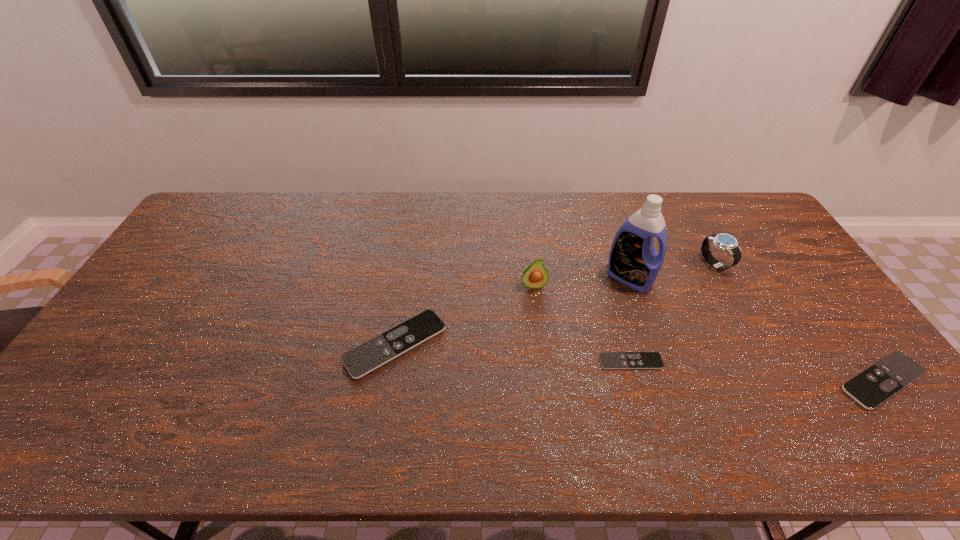
This screenshot has height=540, width=960. I want to click on vacant region located 0.230m on the back of the leftmost object, so click(410, 259).

Identify the location of vacant space located on the left of the shortest remote control. This screenshot has width=960, height=540. (500, 362).

I want to click on vacant space situated 0.070m on the back of the second shortest remote control, so click(x=847, y=332).

Locate an element on the screen. The width and height of the screenshot is (960, 540). vacant space located 0.090m on the front of the detergent is located at coordinates (642, 316).

The height and width of the screenshot is (540, 960). Identify the location of free space located on the right of the watch. (746, 264).

The image size is (960, 540). Find the location of `vacant space positioned 0.140m on the cut side of the avocado`. vacant space positioned 0.140m on the cut side of the avocado is located at coordinates (539, 328).

Where is `object positioned at the right edge`? The height and width of the screenshot is (540, 960). object positioned at the right edge is located at coordinates (875, 385).

The width and height of the screenshot is (960, 540). I want to click on object at the near right corner, so (875, 385).

Where is `free spot at the far edge of the desktop`? free spot at the far edge of the desktop is located at coordinates (470, 202).

Identify the location of free spot at the near edge of the desktop. (270, 401).